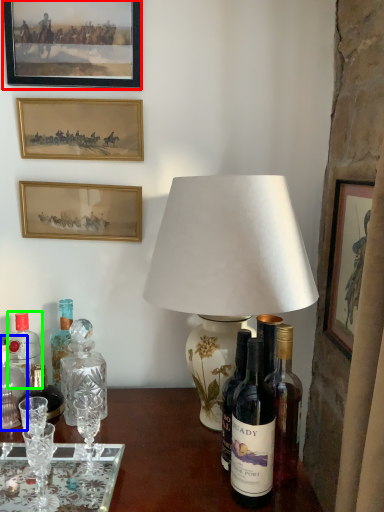
Question: Which object is the closest to the picture frame (highlighted by a red box)? Choose among these: bottle (highlighted by a blue box) or bottle (highlighted by a green box).

Choices:
 (A) bottle
 (B) bottle

Answer: (B)